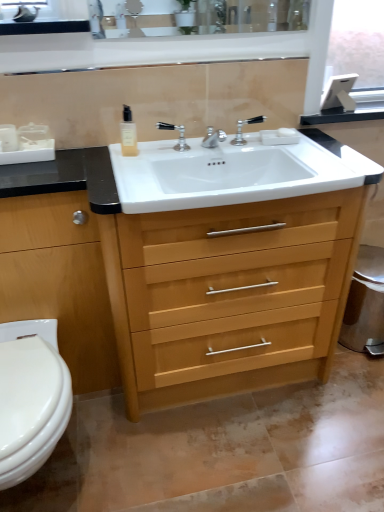
Question: Is light wood/finish chest of drawers at left positioned with its back to white glossy sink at center?

Choices:
 (A) no
 (B) yes

Answer: (A)

Question: Considering the relative sizes of light wood/finish chest of drawers at left and white glossy sink at center in the image provided, is light wood/finish chest of drawers at left smaller than white glossy sink at center?

Choices:
 (A) yes
 (B) no

Answer: (B)

Question: Considering the relative sizes of light wood/finish chest of drawers at left and white glossy sink at center in the image provided, is light wood/finish chest of drawers at left bigger than white glossy sink at center?

Choices:
 (A) no
 (B) yes

Answer: (B)

Question: Considering the relative positions of light wood/finish chest of drawers at left and white glossy sink at center in the image provided, is light wood/finish chest of drawers at left to the left of white glossy sink at center from the viewer's perspective?

Choices:
 (A) yes
 (B) no

Answer: (A)

Question: Is light wood/finish chest of drawers at left further to the viewer compared to white glossy sink at center?

Choices:
 (A) no
 (B) yes

Answer: (B)

Question: Is light wood/finish chest of drawers at left touching white glossy sink at center?

Choices:
 (A) yes
 (B) no

Answer: (B)

Question: Can you confirm if light wood/wooden vanity at center is positioned to the left of white matte soap at upper center?

Choices:
 (A) no
 (B) yes

Answer: (B)

Question: Is light wood/wooden vanity at center far from white matte soap at upper center?

Choices:
 (A) yes
 (B) no

Answer: (B)

Question: Does light wood/wooden vanity at center have a greater width compared to white matte soap at upper center?

Choices:
 (A) yes
 (B) no

Answer: (A)

Question: Is light wood/wooden vanity at center positioned in front of white matte soap at upper center?

Choices:
 (A) no
 (B) yes

Answer: (B)

Question: From a real-world perspective, is light wood/wooden vanity at center positioned under white matte soap at upper center based on gravity?

Choices:
 (A) no
 (B) yes

Answer: (B)

Question: Considering the relative sizes of light wood/wooden vanity at center and white matte soap at upper center in the image provided, is light wood/wooden vanity at center taller than white matte soap at upper center?

Choices:
 (A) no
 (B) yes

Answer: (B)

Question: Are white plastic container at left and white glossy sink at center beside each other?

Choices:
 (A) yes
 (B) no

Answer: (B)